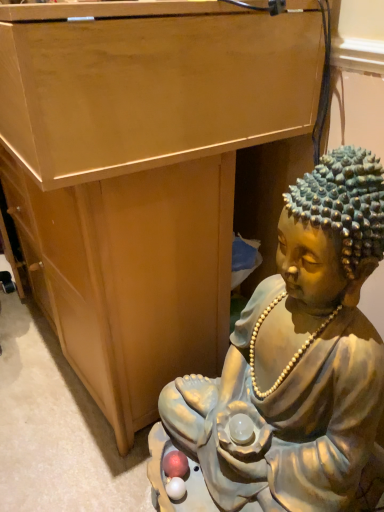
Question: Should I look upward or downward to see matte gold statue at lower right?

Choices:
 (A) down
 (B) up

Answer: (A)